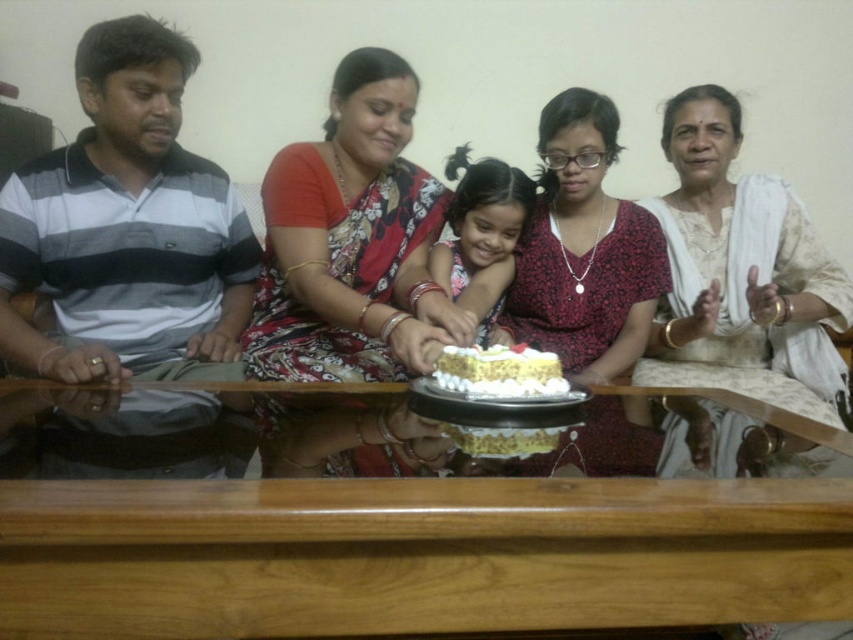
This screenshot has width=853, height=640. Describe the element at coordinates (490, 76) in the screenshot. I see `smooth white cake at center` at that location.

Does smooth white cake at center lie in front of white textured saree at right?

No, it is not.

Describe the element at coordinates (490, 76) in the screenshot. I see `smooth white cake at center` at that location.

This screenshot has height=640, width=853. What are the coordinates of `smooth white cake at center` in the screenshot? It's located at (490, 76).

Is floral saree at center below white cream cake at center?

Incorrect, floral saree at center is not positioned below white cream cake at center.

Does point (410, 360) lie in front of point (438, 376)?

No, (410, 360) is behind (438, 376).

Identify the location of floral saree at center. Image resolution: width=853 pixels, height=640 pixels. (351, 241).

Who is positioned more to the right, white textured saree at right or floral fabric dress at center?

From the viewer's perspective, white textured saree at right appears more on the right side.

Does point (689, 285) come in front of point (550, 269)?

No, it is not.

Between point (843, 316) and point (566, 90), which one is positioned in front?

Point (843, 316) is more forward.

In order to click on white textured saree at right in this screenshot , I will do `click(741, 269)`.